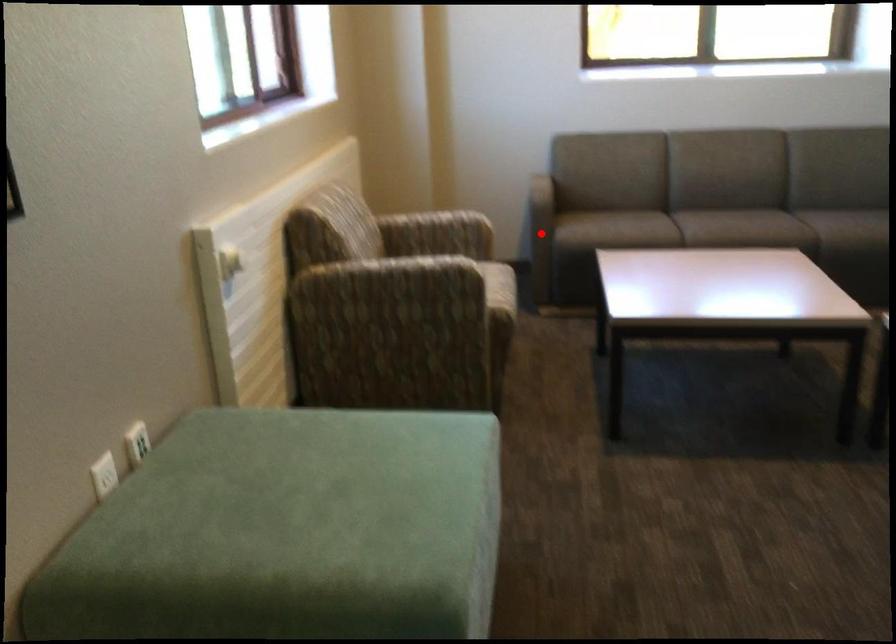
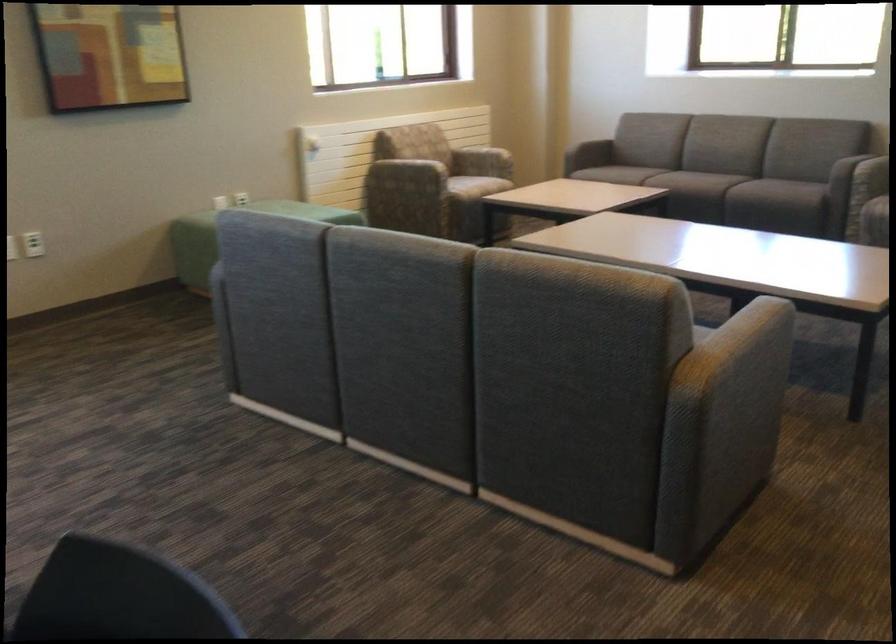
Question: I am providing you with two images of the same scene from different viewpoints. A red point is marked on the first image. Can you still see the location of the red point in image 2?

Choices:
 (A) Yes
 (B) No

Answer: (B)